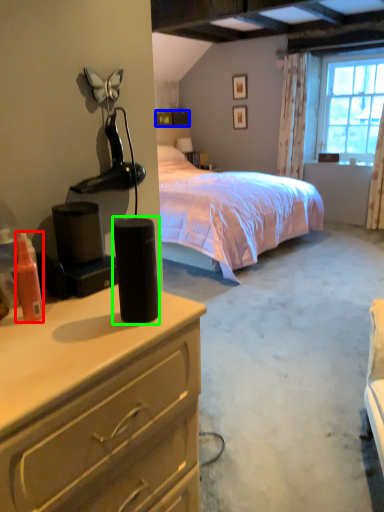
Question: Based on their relative distances, which object is nearer to bottle (highlighted by a red box)? Choose from box (highlighted by a blue box) and speaker (highlighted by a green box).

Choices:
 (A) box
 (B) speaker

Answer: (B)